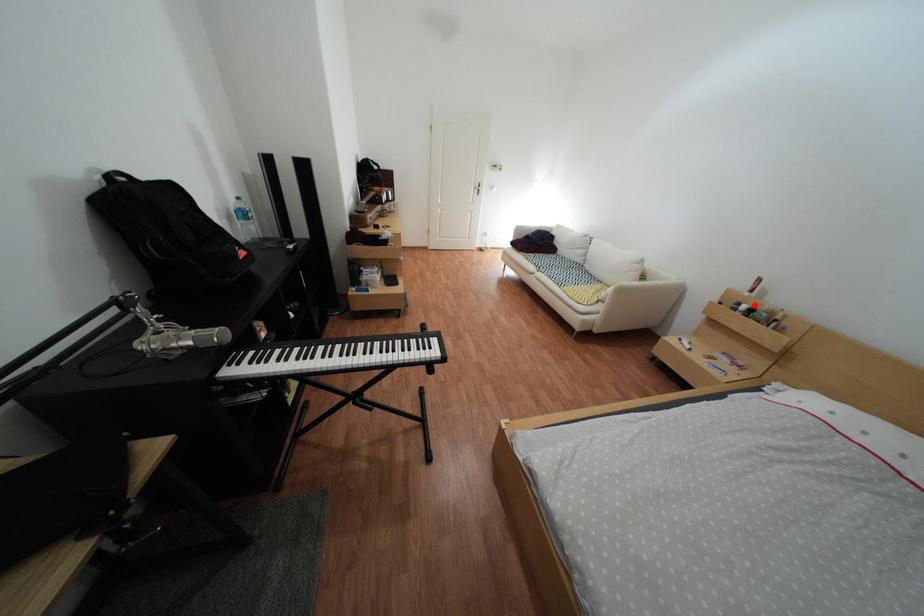
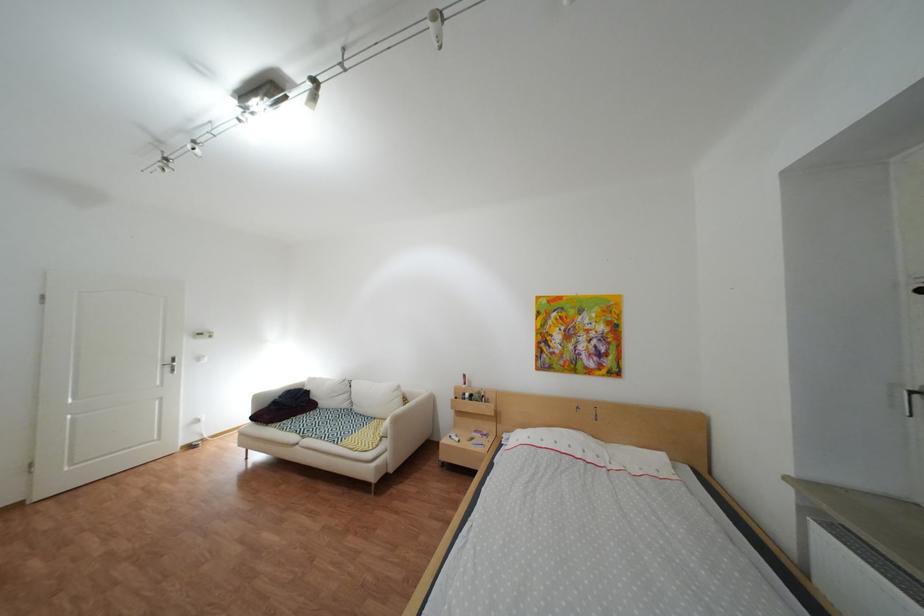
Find the pixel in the second image that matches the highlighted location in the first image.

(480, 395)